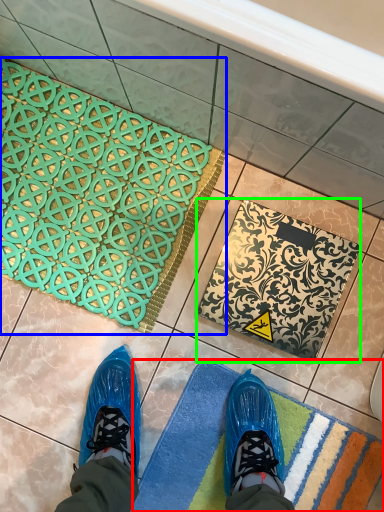
Question: Which object is the closest to the bath mat (highlighted by a red box)? Choose among these: bath mat (highlighted by a blue box) or bath mat (highlighted by a green box).

Choices:
 (A) bath mat
 (B) bath mat

Answer: (B)